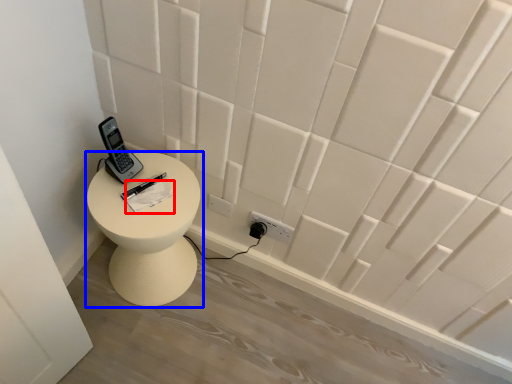
Question: Which point is closer to the camera, notepad (highlighted by a red box) or furniture (highlighted by a blue box)?

Choices:
 (A) notepad
 (B) furniture

Answer: (B)